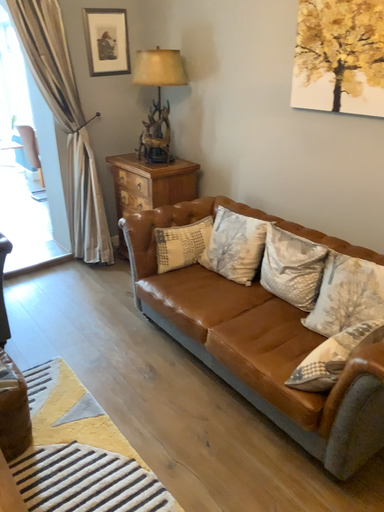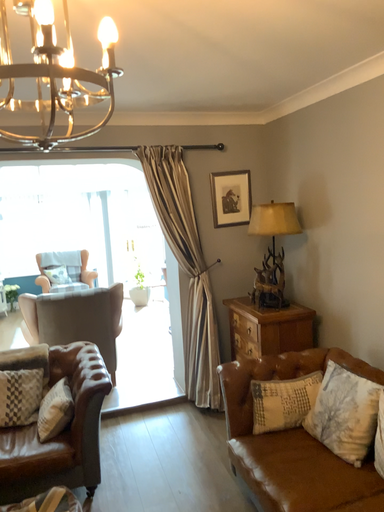
Question: Which way did the camera rotate in the video?

Choices:
 (A) rotated left
 (B) rotated right

Answer: (A)